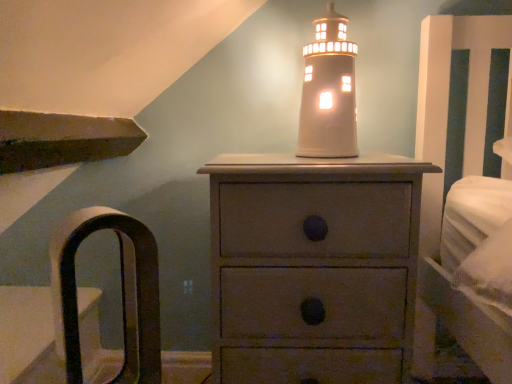
Question: Does white ceramic lighthouse at center have a greater width compared to brown leather armchair at left?

Choices:
 (A) no
 (B) yes

Answer: (A)

Question: Could you tell me if white ceramic lighthouse at center is facing brown leather armchair at left?

Choices:
 (A) yes
 (B) no

Answer: (B)

Question: From the image's perspective, would you say white ceramic lighthouse at center is shown under brown leather armchair at left?

Choices:
 (A) no
 (B) yes

Answer: (A)

Question: Is white ceramic lighthouse at center outside brown leather armchair at left?

Choices:
 (A) no
 (B) yes

Answer: (B)

Question: Does white ceramic lighthouse at center appear on the left side of brown leather armchair at left?

Choices:
 (A) no
 (B) yes

Answer: (A)

Question: Is brown leather armchair at left at the back of white ceramic lighthouse at center?

Choices:
 (A) yes
 (B) no

Answer: (B)

Question: Does brown leather armchair at left have a larger size compared to matte gray chest of drawers at center?

Choices:
 (A) yes
 (B) no

Answer: (B)

Question: Is brown leather armchair at left to the left of matte gray chest of drawers at center from the viewer's perspective?

Choices:
 (A) yes
 (B) no

Answer: (A)

Question: From a real-world perspective, does brown leather armchair at left stand above matte gray chest of drawers at center?

Choices:
 (A) no
 (B) yes

Answer: (B)

Question: Is brown leather armchair at left beside matte gray chest of drawers at center?

Choices:
 (A) yes
 (B) no

Answer: (B)

Question: Is brown leather armchair at left located outside matte gray chest of drawers at center?

Choices:
 (A) no
 (B) yes

Answer: (B)

Question: Is brown leather armchair at left smaller than matte gray chest of drawers at center?

Choices:
 (A) no
 (B) yes

Answer: (B)

Question: Is brown leather armchair at left thinner than white ceramic lighthouse at center?

Choices:
 (A) no
 (B) yes

Answer: (A)